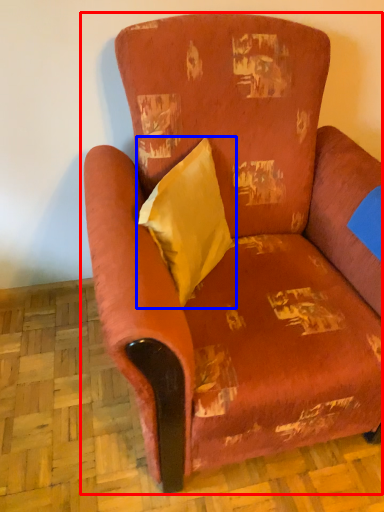
Question: Which object appears farthest to the camera in this image, chair (highlighted by a red box) or throw pillow (highlighted by a blue box)?

Choices:
 (A) chair
 (B) throw pillow

Answer: (B)